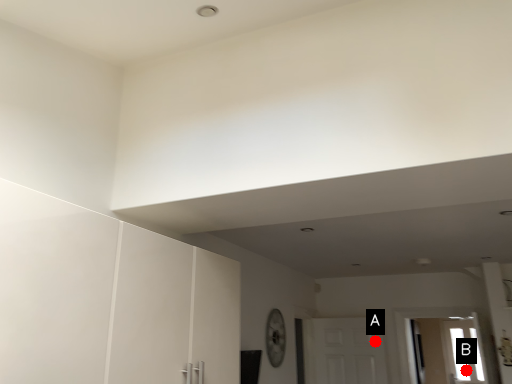
Question: Two points are circled on the image, labeled by A and B beside each circle. Which point is closer to the camera?

Choices:
 (A) A is closer
 (B) B is closer

Answer: (B)